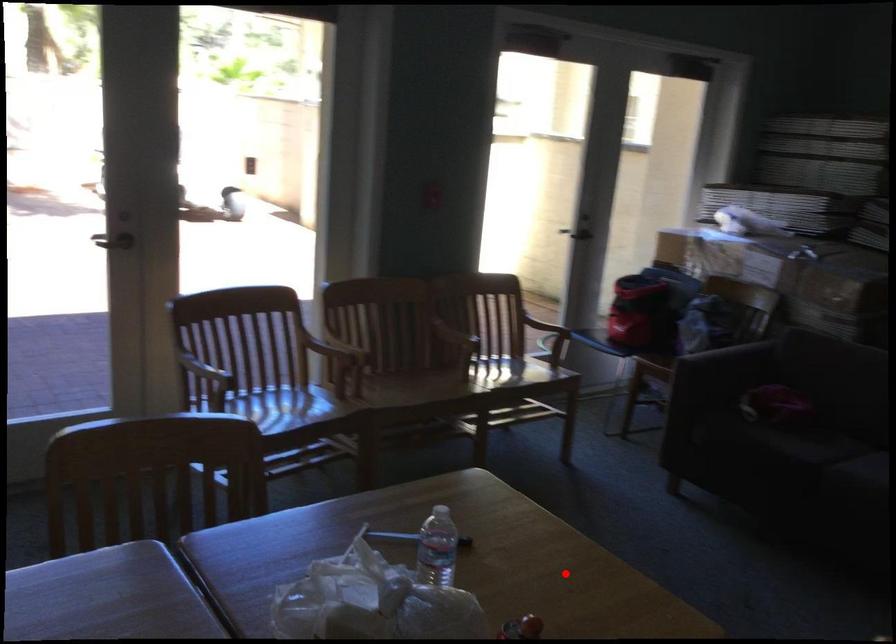
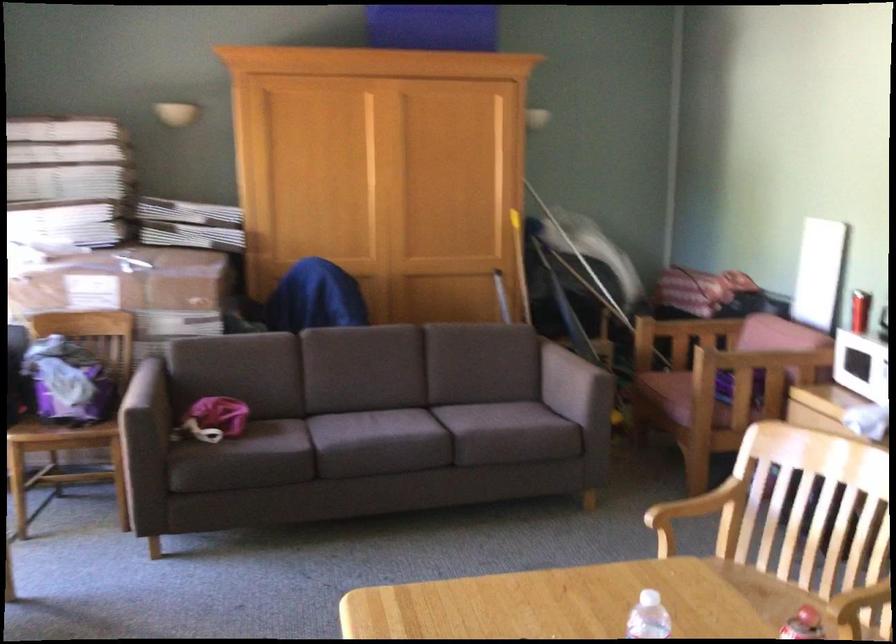
Locate, in the second image, the point that corresponds to the highlighted location in the first image.

(555, 603)